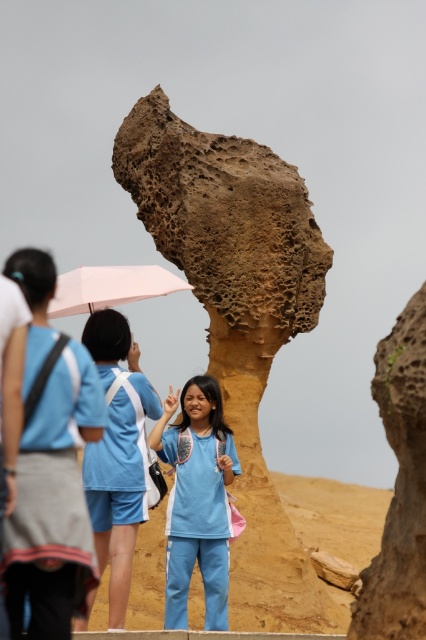
Question: Is light blue fabric at center below white matte umbrella at center?

Choices:
 (A) yes
 (B) no

Answer: (A)

Question: Is brown porous rock at center behind light blue fabric at center?

Choices:
 (A) no
 (B) yes

Answer: (B)

Question: Which point appears closest to the camera in this image?

Choices:
 (A) (229, 372)
 (B) (71, 284)
 (C) (423, 484)

Answer: (C)

Question: Which point is closer to the camera?

Choices:
 (A) (196, 604)
 (B) (150, 390)
 (C) (31, 618)

Answer: (C)

Question: Can you confirm if light blue fabric at center is smaller than white matte umbrella at center?

Choices:
 (A) no
 (B) yes

Answer: (B)

Question: Which object appears closest to the camera in this image?

Choices:
 (A) brown rough rock at center
 (B) white matte umbrella at center
 (C) light blue fabric at center
 (D) brown porous rock at center

Answer: (A)